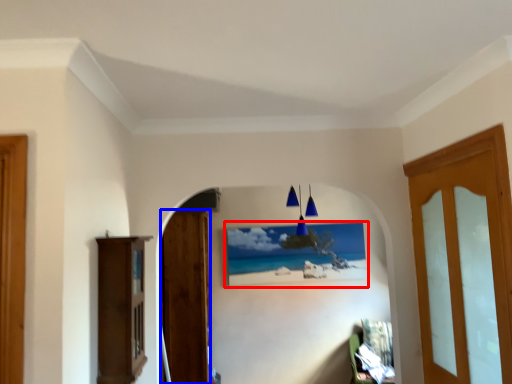
Question: Which point is closer to the camera, picture frame (highlighted by a red box) or door (highlighted by a blue box)?

Choices:
 (A) picture frame
 (B) door

Answer: (B)